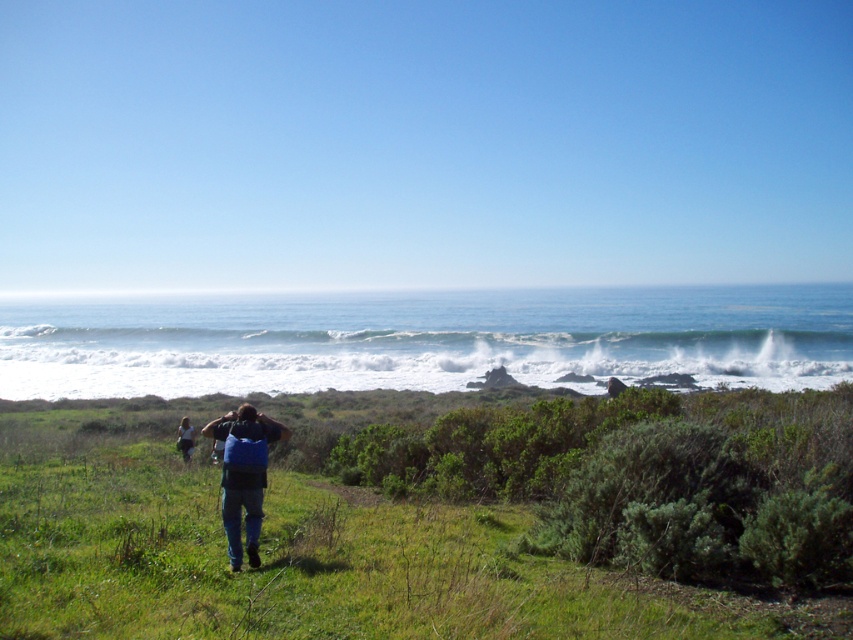
Question: Does green grassy at center appear on the right side of blue fabric backpack at center?

Choices:
 (A) yes
 (B) no

Answer: (B)

Question: Which point is closer to the camera?

Choices:
 (A) blue fabric backpack at lower center
 (B) blue fabric backpack at center
 (C) green grassy at center

Answer: (C)

Question: Is the position of blue fabric backpack at center more distant than that of blue fabric backpack at lower center?

Choices:
 (A) yes
 (B) no

Answer: (B)

Question: Among these points, which one is nearest to the camera?

Choices:
 (A) (262, 477)
 (B) (180, 448)

Answer: (A)

Question: Among these points, which one is farthest from the camera?

Choices:
 (A) (387, 490)
 (B) (183, 433)

Answer: (B)

Question: Does blue fabric backpack at center appear on the right side of blue fabric backpack at lower center?

Choices:
 (A) no
 (B) yes

Answer: (B)